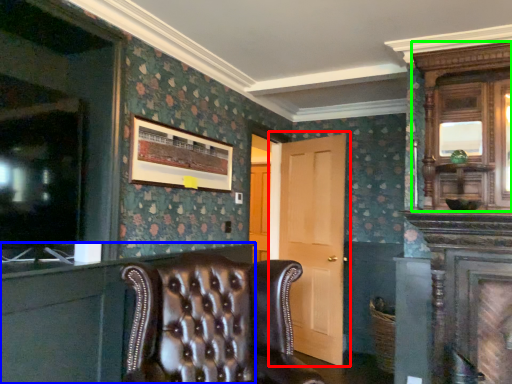
Question: Considering the real-world distances, which object is closest to door (highlighted by a red box)? dresser (highlighted by a blue box) or armoire (highlighted by a green box).

Choices:
 (A) dresser
 (B) armoire

Answer: (B)